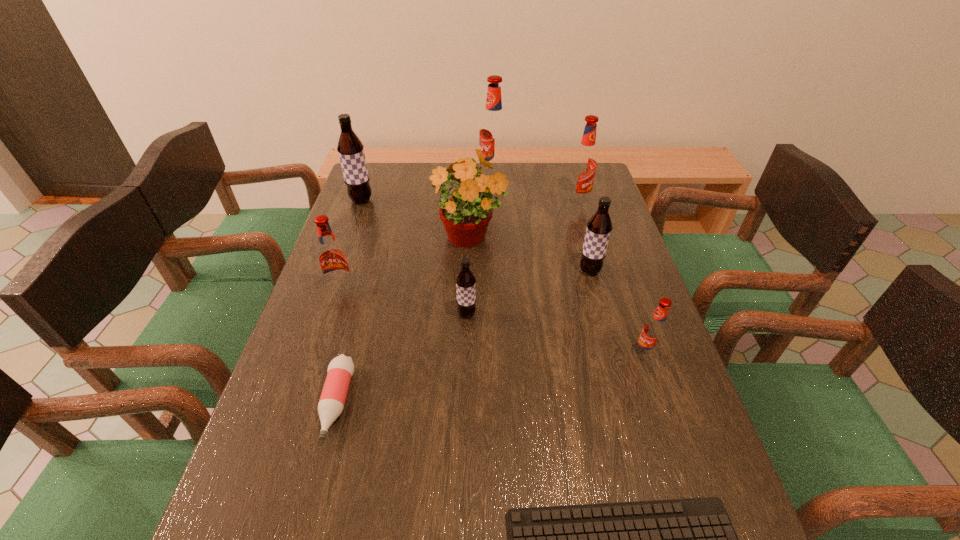
In the image, there is a desktop. At what (x,y) coordinates should I click in order to perform the action: click on free region at the right edge. Please return your answer as a coordinate pair (x, y). This screenshot has width=960, height=540. Looking at the image, I should click on (675, 498).

Identify the location of free space at the far left corner. This screenshot has height=540, width=960. (379, 176).

Find the location of a particular element. This screenshot has width=960, height=540. vacant space that's between the nearest root beer and the second biggest brown root beer is located at coordinates (617, 312).

The height and width of the screenshot is (540, 960). In order to click on free space that is in between the nearest root beer and the smallest brown root beer in this screenshot , I will do `click(556, 334)`.

This screenshot has width=960, height=540. What are the coordinates of `empty space between the fifth nearest object and the fifth root beer from right to left` in the screenshot? It's located at click(x=404, y=302).

Locate an element on the screen. The width and height of the screenshot is (960, 540). vacant point located between the pink bottle and the nearest root beer is located at coordinates (491, 378).

Identify which object is the ninth closest to the nearest brown root beer. Please provide its 2D coordinates. Your answer should be formatted as a tuple, i.e. [(x, y)], where the tuple contains the x and y coordinates of a point satisfying the conditions above.

[(493, 135)]

The height and width of the screenshot is (540, 960). Identify the location of the sixth closest object to the nearest root beer. (340, 370).

The image size is (960, 540). Identify the location of root beer that is the closest to the sixth farthest root beer. (x=332, y=258).

You are a GUI agent. You are given a task and a screenshot of the screen. Output one action in this format:
    pyautogui.click(x=<x>, y=<y>)
    Task: Click on the root beer that stands as the second closest to the second farthest red root beer
    Image resolution: width=960 pixels, height=540 pixels.
    Given the screenshot: What is the action you would take?
    pyautogui.click(x=599, y=227)